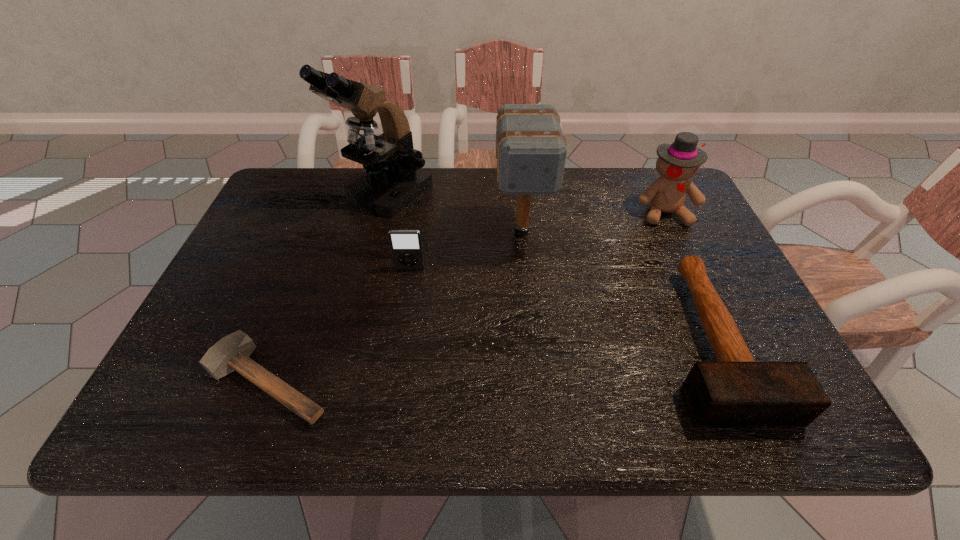
At what (x,y) coordinates should I click in order to perform the action: click on free spot at the far right corner of the desktop. Please return your answer as a coordinate pair (x, y). The height and width of the screenshot is (540, 960). Looking at the image, I should click on (649, 176).

At what (x,y) coordinates should I click in order to perform the action: click on vacant area that lies between the shortest mallet and the fourth tallest object. Please return your answer as a coordinate pair (x, y). Looking at the image, I should click on (339, 325).

Locate an element on the screen. This screenshot has height=540, width=960. vacant space that is in between the iPod and the shortest object is located at coordinates (339, 325).

Where is `free spot between the second shortest mallet and the leftmost mallet`? The width and height of the screenshot is (960, 540). free spot between the second shortest mallet and the leftmost mallet is located at coordinates (490, 360).

Identify the location of blank region between the rag_doll and the shortest mallet. Image resolution: width=960 pixels, height=540 pixels. (467, 296).

This screenshot has width=960, height=540. I want to click on vacant area that lies between the tallest mallet and the fourth shortest object, so click(592, 222).

Find the location of a particular element. This screenshot has width=960, height=540. free area in between the leftmost mallet and the third nearest object is located at coordinates (339, 325).

Locate an element on the screen. blank region between the second tallest mallet and the tallest object is located at coordinates (550, 267).

I want to click on object that ranks as the third closest to the third object from right to left, so click(736, 391).

Identify which object is located as the third nearest to the fifth tallest object. Please provide its 2D coordinates. Your answer should be formatted as a tuple, i.e. [(x, y)], where the tuple contains the x and y coordinates of a point satisfying the conditions above.

[(406, 246)]